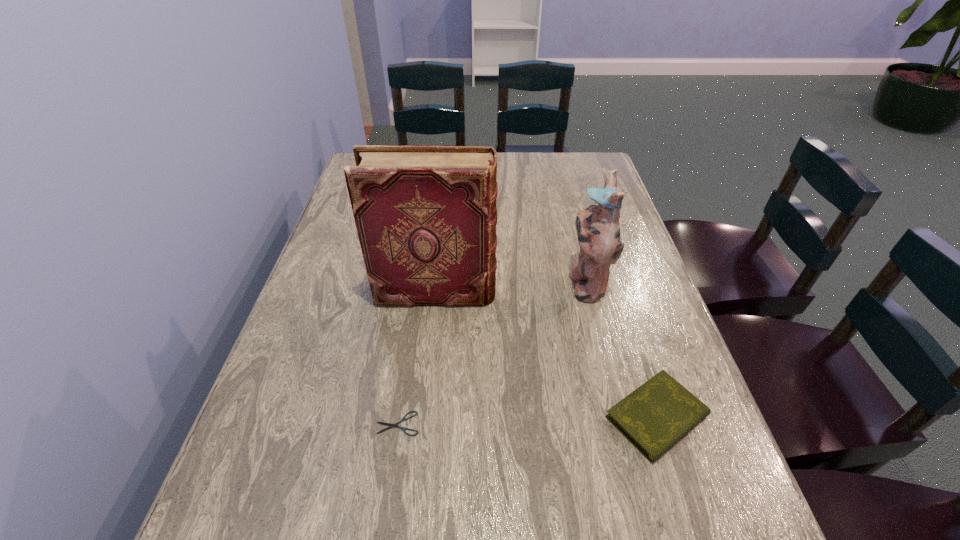
The height and width of the screenshot is (540, 960). Find the location of `hardback book`. hardback book is located at coordinates (426, 216).

Locate an element on the screen. The height and width of the screenshot is (540, 960). the second tallest object is located at coordinates (597, 226).

Identify the location of the second shortest object. (654, 417).

Identify the location of shears. (403, 419).

You are a GUI agent. You are given a task and a screenshot of the screen. Output one action in this format:
    pyautogui.click(x=<x>, y=<y>)
    Task: Click on the free space located on the spine side of the hardback book
    The width and height of the screenshot is (960, 540).
    Given the screenshot: What is the action you would take?
    pyautogui.click(x=613, y=293)

At what (x,y) coordinates should I click in order to perform the action: click on vacant space located on the front-facing side of the figurine. Please return your answer as a coordinate pair (x, y). The width and height of the screenshot is (960, 540). Looking at the image, I should click on (407, 283).

Image resolution: width=960 pixels, height=540 pixels. I want to click on free space located 0.090m on the front-facing side of the figurine, so click(530, 283).

You are a GUI agent. You are given a task and a screenshot of the screen. Output one action in this format:
    pyautogui.click(x=<x>, y=<y>)
    Task: Click on the blank space located on the front-facing side of the figurine
    
    Given the screenshot: What is the action you would take?
    pyautogui.click(x=497, y=283)

Find the location of a particular element. free space located 0.170m on the back of the diary is located at coordinates (623, 313).

Locate an element on the screen. Image resolution: width=960 pixels, height=540 pixels. vacant region located 0.310m on the right of the shears is located at coordinates (589, 423).